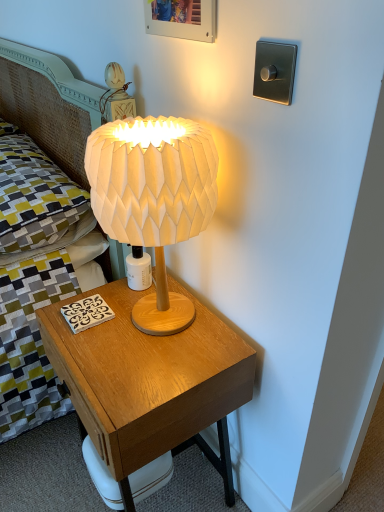
Where is `blank space situated above wooden nightstand at center (from a real-world perspective)`? This screenshot has height=512, width=384. blank space situated above wooden nightstand at center (from a real-world perspective) is located at coordinates (141, 335).